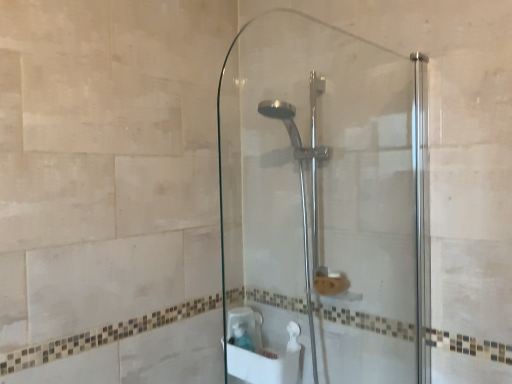
Question: Is polished chrome shower head at center directly adjacent to transparent glass shower door at center?

Choices:
 (A) yes
 (B) no

Answer: (B)

Question: Would you consider polished chrome shower head at center to be distant from transparent glass shower door at center?

Choices:
 (A) no
 (B) yes

Answer: (A)

Question: Considering the relative sizes of polished chrome shower head at center and transparent glass shower door at center in the image provided, is polished chrome shower head at center taller than transparent glass shower door at center?

Choices:
 (A) no
 (B) yes

Answer: (B)

Question: Is polished chrome shower head at center facing towards transparent glass shower door at center?

Choices:
 (A) yes
 (B) no

Answer: (B)

Question: Is the position of polished chrome shower head at center more distant than that of transparent glass shower door at center?

Choices:
 (A) yes
 (B) no

Answer: (A)

Question: Is polished chrome shower head at center closer to the viewer compared to transparent glass shower door at center?

Choices:
 (A) no
 (B) yes

Answer: (A)

Question: Could you tell me if transparent glass shower door at center is facing polished chrome shower head at center?

Choices:
 (A) yes
 (B) no

Answer: (A)

Question: Is transparent glass shower door at center positioned behind polished chrome shower head at center?

Choices:
 (A) yes
 (B) no

Answer: (B)

Question: Is transparent glass shower door at center wider than polished chrome shower head at center?

Choices:
 (A) yes
 (B) no

Answer: (B)

Question: Considering the relative sizes of transparent glass shower door at center and polished chrome shower head at center in the image provided, is transparent glass shower door at center bigger than polished chrome shower head at center?

Choices:
 (A) no
 (B) yes

Answer: (A)

Question: Does transparent glass shower door at center have a lesser height compared to polished chrome shower head at center?

Choices:
 (A) yes
 (B) no

Answer: (A)

Question: Is transparent glass shower door at center positioned before polished chrome shower head at center?

Choices:
 (A) yes
 (B) no

Answer: (A)

Question: Is polished chrome shower head at center bigger or smaller than transparent glass shower door at center?

Choices:
 (A) small
 (B) big

Answer: (B)